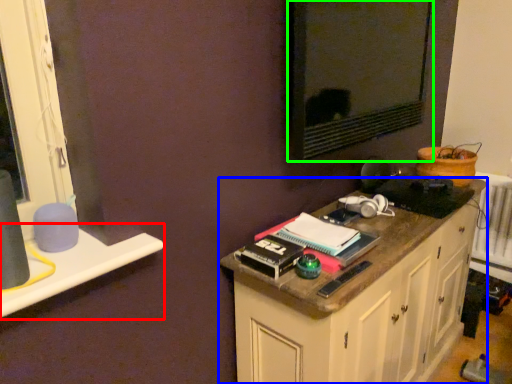
Question: Based on their relative distances, which object is nearer to window sill (highlighted by a red box)? Choose from cabinetry (highlighted by a blue box) and wide (highlighted by a green box).

Choices:
 (A) cabinetry
 (B) wide

Answer: (A)